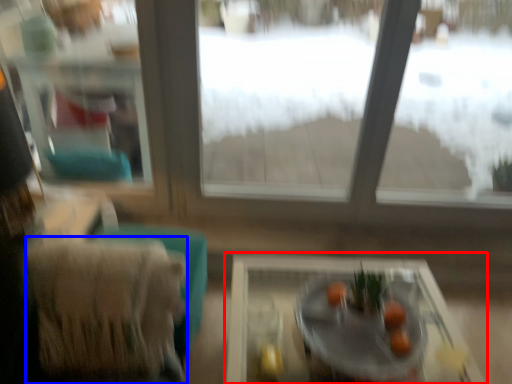
Question: Which object is further to the camera taking this photo, table (highlighted by a red box) or armchair (highlighted by a blue box)?

Choices:
 (A) table
 (B) armchair

Answer: (B)